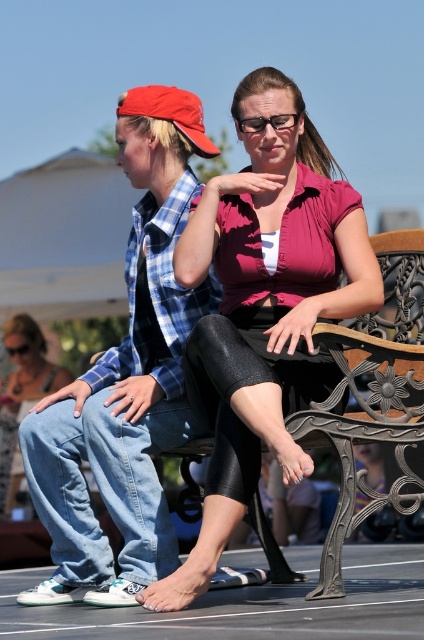
You are a photographer trying to capture a candid shot of two people sitting on a bench. You notice the matte pink blouse at center and the denim pants at left. Based on their positions, which clothing item is located to the right of the other?

The matte pink blouse at center is positioned on the right side of denim pants at left.

You are designing a catalog layout for a clothing brand. The matte pink blouse at center and denim jeans at left need to be displayed next to each other. Given their sizes, which item should be placed first to ensure proper visibility of both?

The matte pink blouse at center should be placed first since it is larger in size than the denim jeans at left, allowing both items to be clearly visible without overcrowding.

Based on the photo, you are a photographer setting up a photo shoot in an outdoor park. You have two subjects wearing a matte pink blouse at center and denim jeans at left. Based on the scene, which clothing item appears shorter in height?

The matte pink blouse at center is not as tall as the denim jeans at left, so the matte pink blouse at center appears shorter in height.